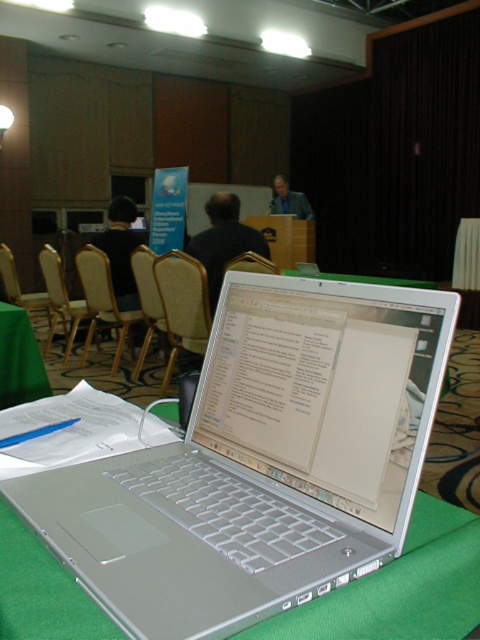
You are sitting at a table with a silver laptop on a green tablecloth and need to move to the light beige leather chair at center. The coordinates of the chair are given as point (103, 300). If your current position is at point 0.300, 0.150, what direction should you move to reach the chair?

To reach the light beige leather chair at center located at point (103, 300) from your current position at 0.300, 0.150, you should move northeast since the chair is northeast of your current position.

You are sitting in the light beige fabric chair at left and want to move to the light beige leather chair at center. Which direction should you move to reach it?

The light beige leather chair at center is positioned on the right side of the light beige fabric chair at left, so you should move to your right to reach it.

You are sitting at the conference table with the silver laptop on the green tablecloth. You notice two points marked in the image at coordinates point (197, 294) and point (124, 330). From your perspective at the table, which point is closer to you?

Point (197, 294) is in front of point (124, 330), so it is closer to you.